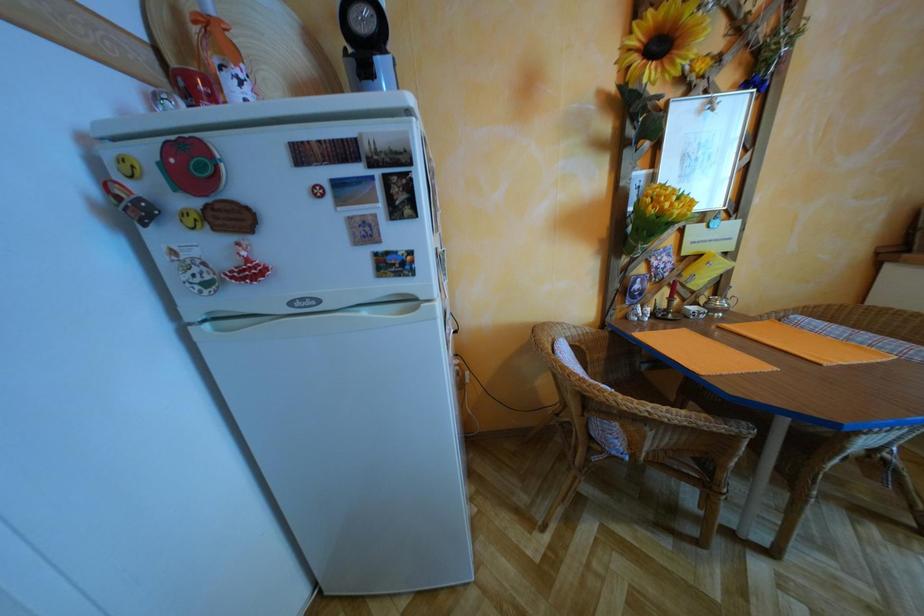
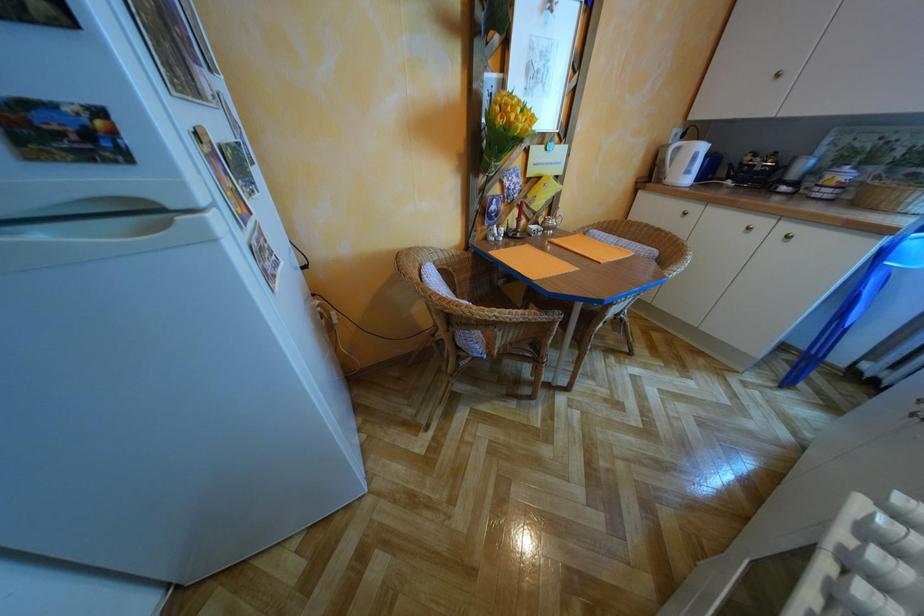
From the picture: The first image is from the beginning of the video and the second image is from the end. How did the camera likely rotate when shooting the video?

The camera rotated toward right-down.